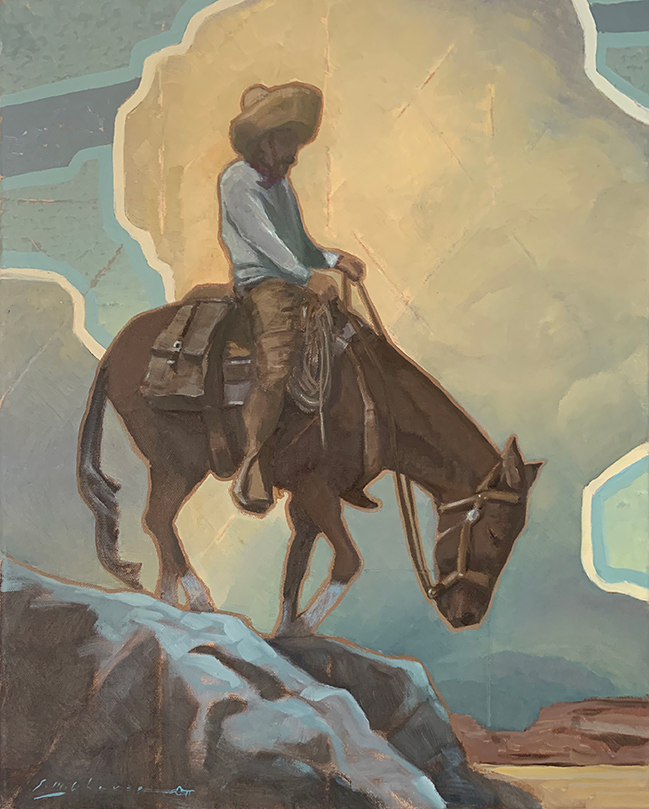
The image size is (649, 809). I want to click on floor, so click(x=579, y=803).